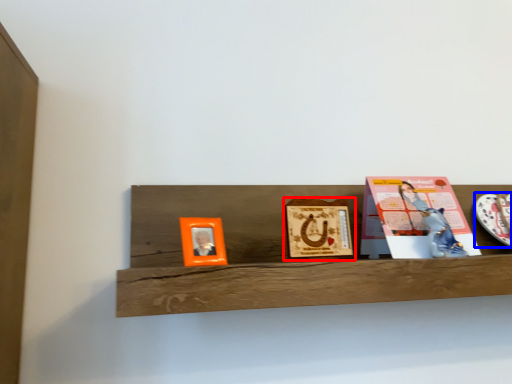
Question: Which object appears farthest to the camera in this image, picture frame (highlighted by a red box) or platter (highlighted by a blue box)?

Choices:
 (A) picture frame
 (B) platter

Answer: (B)